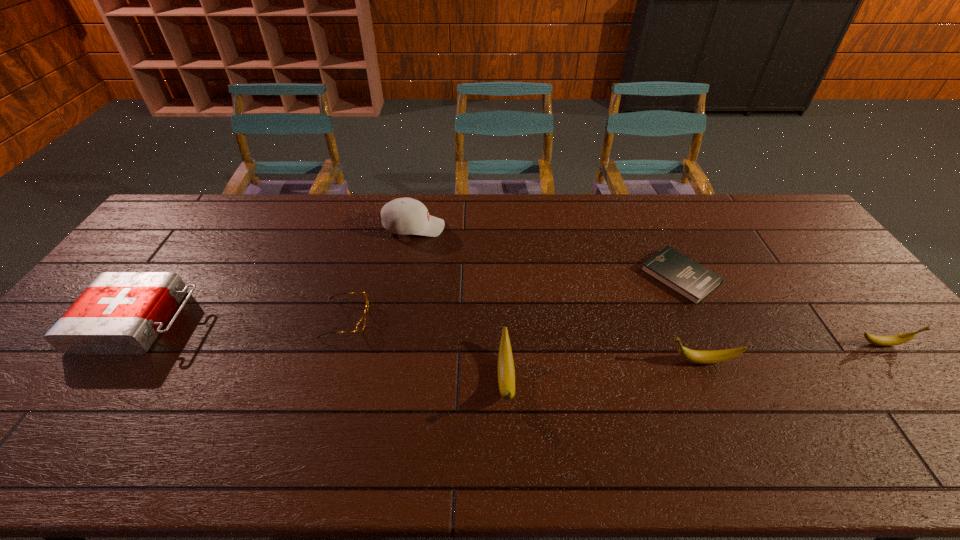
At what (x,y) coordinates should I click in order to perform the action: click on vacant point that satisfies the following two spatial constraints: 1. at the stem of the second banana from left to right; 2. at the stem of the leftmost banana. Please return your answer as a coordinate pair (x, y). The image size is (960, 540). Looking at the image, I should click on (709, 380).